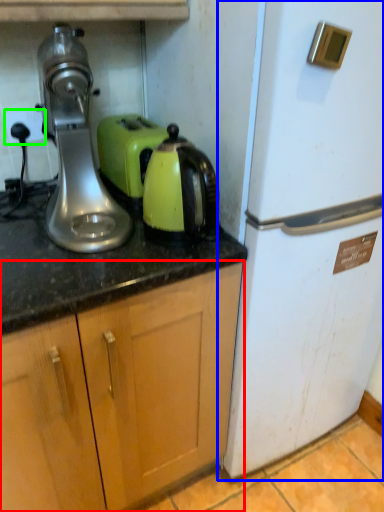
Question: Which is nearer to the cabinetry (highlighted by a red box)? refrigerator (highlighted by a blue box) or electric outlet (highlighted by a green box).

Choices:
 (A) refrigerator
 (B) electric outlet

Answer: (A)